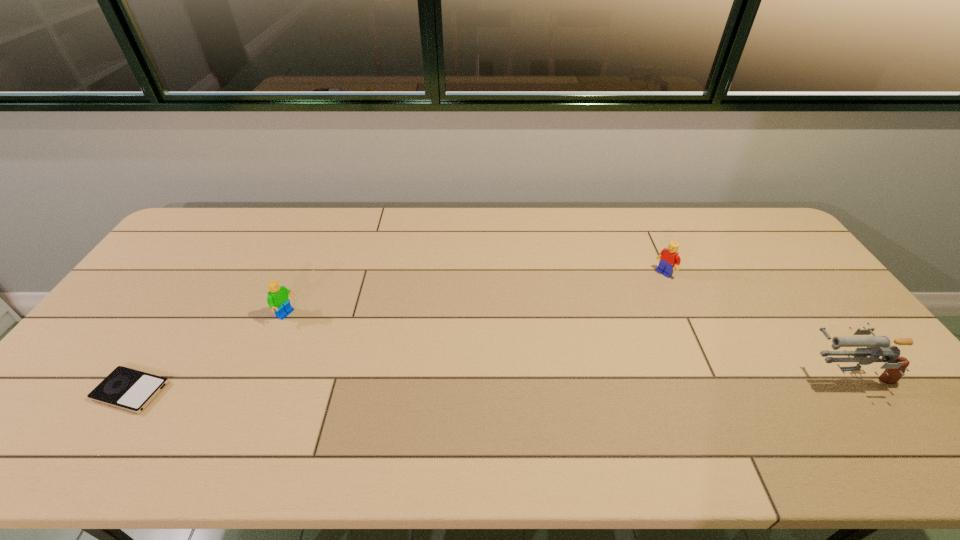
Identify which object is located as the third nearest to the nearer Lego. Please provide its 2D coordinates. Your answer should be formatted as a tuple, i.e. [(x, y)], where the tuple contains the x and y coordinates of a point satisfying the conditions above.

[(876, 346)]

The height and width of the screenshot is (540, 960). I want to click on free point that satisfies the following two spatial constraints: 1. on the front side of the gun; 2. at the barrel end of the nearer Lego, so click(x=262, y=374).

The image size is (960, 540). Find the location of `free space that satisfies the following two spatial constraints: 1. on the back side of the second object from left to right; 2. on the left side of the leftmost object`. free space that satisfies the following two spatial constraints: 1. on the back side of the second object from left to right; 2. on the left side of the leftmost object is located at coordinates (180, 315).

Identify the location of blank space that satisfies the following two spatial constraints: 1. on the back side of the nearer Lego; 2. on the right side of the farthest object. click(305, 273).